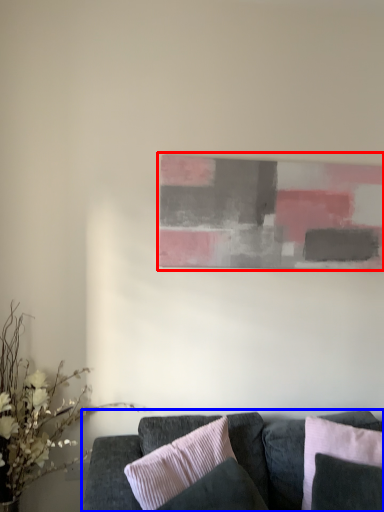
Question: Among these objects, which one is farthest to the camera, picture frame (highlighted by a red box) or studio couch (highlighted by a blue box)?

Choices:
 (A) picture frame
 (B) studio couch

Answer: (A)